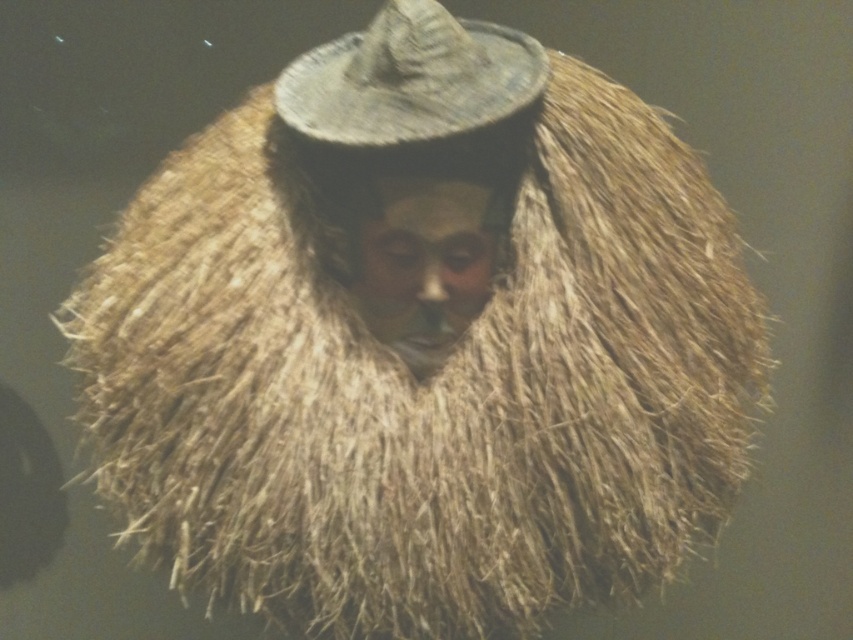
Is point (350, 33) positioned before point (410, 192)?

No, it is not.

In order to click on natural straw hat at center in this screenshot , I will do `click(410, 77)`.